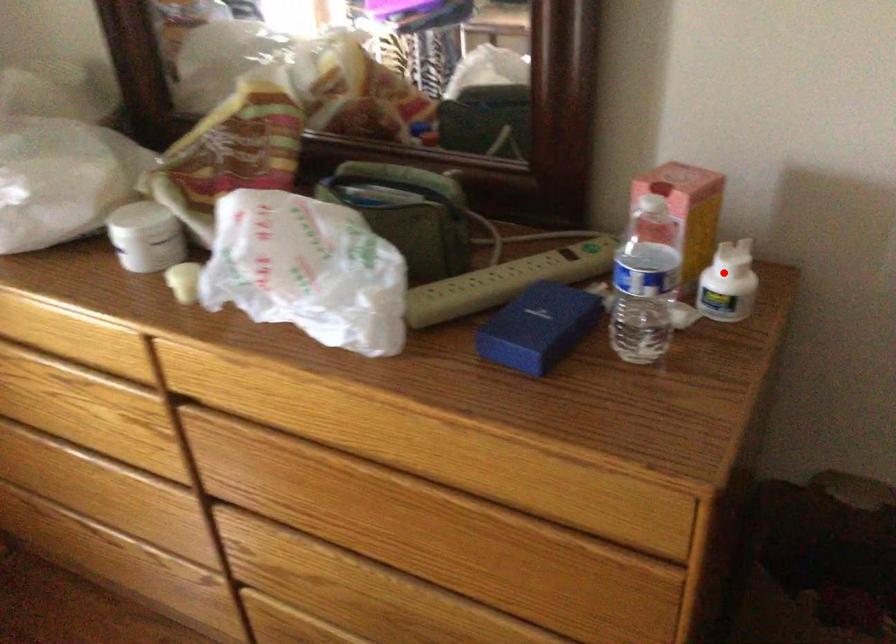
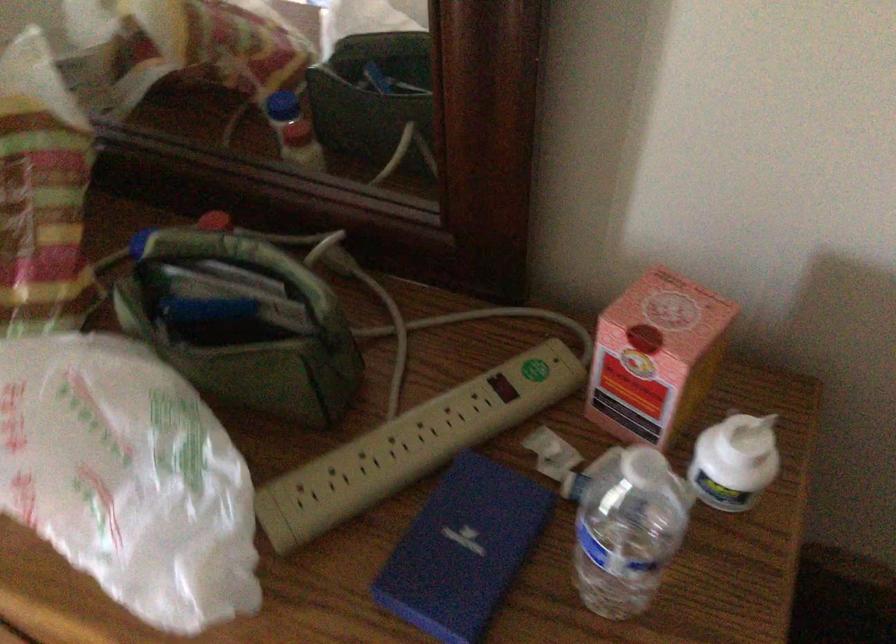
Question: I am providing you with two images of the same scene from different viewpoints. A red point is marked on the first image. Can you still see the location of the red point in image 2?

Choices:
 (A) Yes
 (B) No

Answer: (A)